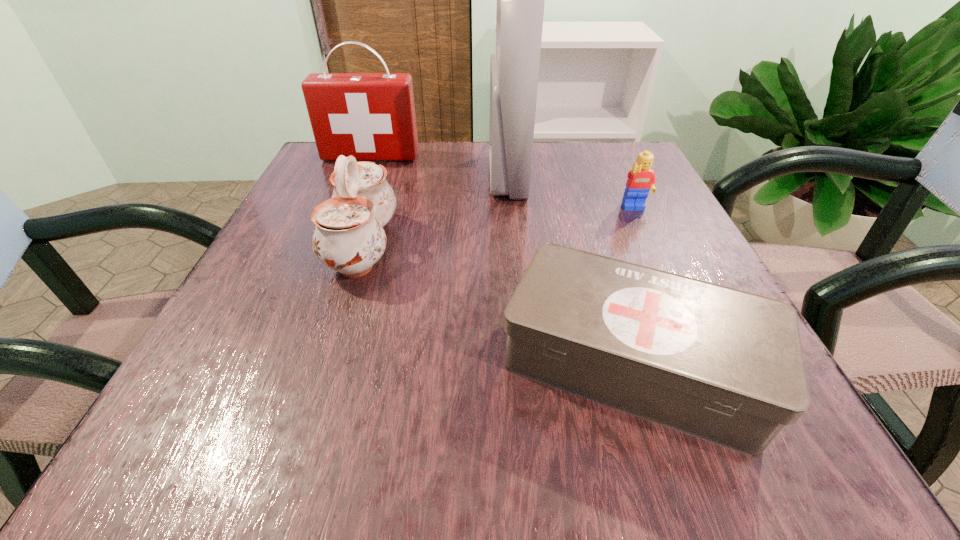
The image size is (960, 540). In order to click on free spot between the leftmost first-aid kit and the tallest first-aid kit in this screenshot , I will do `click(439, 166)`.

What are the coordinates of `free space that is in between the second shortest object and the chinaware` in the screenshot? It's located at (499, 228).

Locate an element on the screen. This screenshot has width=960, height=540. unoccupied area between the nearest object and the chinaware is located at coordinates (497, 305).

The height and width of the screenshot is (540, 960). I want to click on object that can be found as the third closest to the tallest object, so click(x=641, y=180).

Select which object appears as the second closest to the fourth tallest object. Please provide its 2D coordinates. Your answer should be formatted as a tuple, i.e. [(x, y)], where the tuple contains the x and y coordinates of a point satisfying the conditions above.

[(724, 365)]

Locate an element on the screen. the first-aid kit that is the second closest one to the third shortest object is located at coordinates (724, 365).

Identify which first-aid kit is located as the nearest to the second shortest first-aid kit. Please provide its 2D coordinates. Your answer should be formatted as a tuple, i.e. [(x, y)], where the tuple contains the x and y coordinates of a point satisfying the conditions above.

[(514, 70)]

Find the location of a particular element. The image size is (960, 540). vacant space that satisfies the following two spatial constraints: 1. by the handle of the shortest first-aid kit; 2. on the left side of the chinaware is located at coordinates (325, 363).

Where is `vacant space that satisfies the following two spatial constraints: 1. on the back side of the shortest object; 2. on the front-facing side of the tallest first-aid kit`? vacant space that satisfies the following two spatial constraints: 1. on the back side of the shortest object; 2. on the front-facing side of the tallest first-aid kit is located at coordinates (573, 176).

Locate an element on the screen. The height and width of the screenshot is (540, 960). vacant space that satisfies the following two spatial constraints: 1. on the back side of the nearest first-aid kit; 2. by the handle of the chinaware is located at coordinates (595, 246).